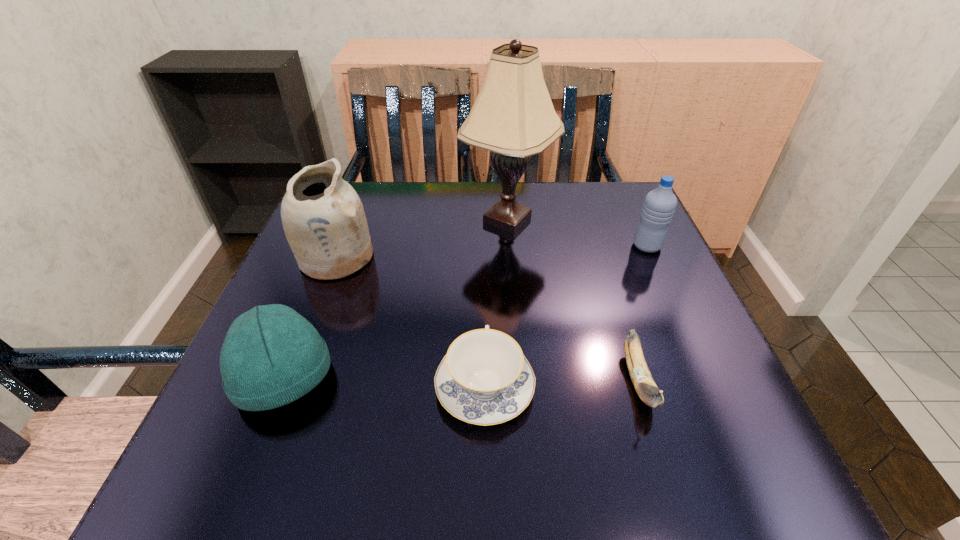
Identify the location of lamp. (513, 116).

Identify the location of pottery. (323, 218).

The width and height of the screenshot is (960, 540). I want to click on the fourth shortest object, so click(x=659, y=205).

You are a GUI agent. You are given a task and a screenshot of the screen. Output one action in this format:
    pyautogui.click(x=<x>, y=<y>)
    Task: Click on the rightmost object
    
    Given the screenshot: What is the action you would take?
    pyautogui.click(x=659, y=205)

Identify the location of the fourth tallest object. Image resolution: width=960 pixels, height=540 pixels. (271, 356).

Find the location of a particular element. This screenshot has width=960, height=540. the second object from right to left is located at coordinates (647, 390).

Find the location of a particular element. chinaware is located at coordinates (484, 379).

Locate an element on the screen. The image size is (960, 540). vacant space located 0.280m on the left of the lamp is located at coordinates (345, 219).

What are the coordinates of `vacant region located on the right of the fifth shortest object` in the screenshot? It's located at (496, 257).

Locate an element on the screen. free space located on the front of the rightmost object is located at coordinates (685, 331).